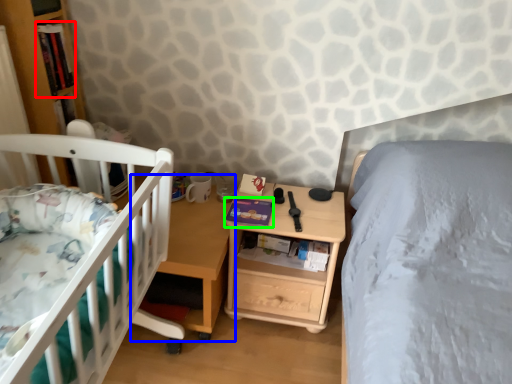
Question: Estimate the real-world distances between objects in this image. Which object is farther from book (highlighted by a red box), table (highlighted by a blue box) or book (highlighted by a green box)?

Choices:
 (A) table
 (B) book

Answer: (B)